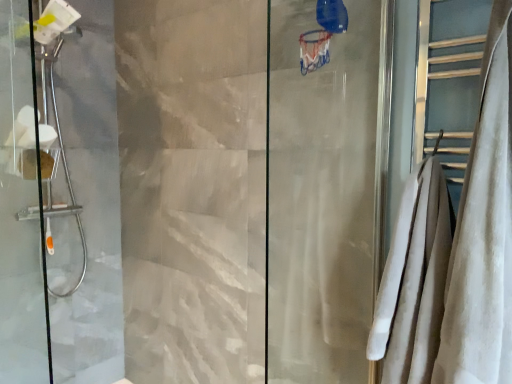
Question: Can you confirm if transparent glass shower door at left, marked as the 1th screen door in a front-to-back arrangement, is thinner than white velvety towel at right?

Choices:
 (A) no
 (B) yes

Answer: (B)

Question: Considering the relative positions of transparent glass shower door at left, positioned as the 2th screen door in back-to-front order, and white velvety towel at right in the image provided, is transparent glass shower door at left, positioned as the 2th screen door in back-to-front order, in front of white velvety towel at right?

Choices:
 (A) yes
 (B) no

Answer: (B)

Question: From the image's perspective, is transparent glass shower door at left, positioned as the 2th screen door in back-to-front order, located beneath white velvety towel at right?

Choices:
 (A) no
 (B) yes

Answer: (B)

Question: Are transparent glass shower door at left, positioned as the 2th screen door in back-to-front order, and white velvety towel at right far apart?

Choices:
 (A) no
 (B) yes

Answer: (B)

Question: Considering the relative positions of transparent glass shower door at left, marked as the 1th screen door in a front-to-back arrangement, and white velvety towel at right in the image provided, is transparent glass shower door at left, marked as the 1th screen door in a front-to-back arrangement, behind white velvety towel at right?

Choices:
 (A) no
 (B) yes

Answer: (B)

Question: From the image's perspective, is brushed metal showerhead at left, the second screen door positioned from the front, above or below white velvety towel at right?

Choices:
 (A) below
 (B) above

Answer: (B)

Question: Considering their positions, is brushed metal showerhead at left, the second screen door positioned from the front, located in front of or behind white velvety towel at right?

Choices:
 (A) behind
 (B) front

Answer: (A)

Question: Is brushed metal showerhead at left, the 1th screen door when ordered from back to front, wider or thinner than white velvety towel at right?

Choices:
 (A) thin
 (B) wide

Answer: (B)

Question: Is brushed metal showerhead at left, the second screen door positioned from the front, taller or shorter than white velvety towel at right?

Choices:
 (A) short
 (B) tall

Answer: (B)

Question: From the image's perspective, relative to white soft towel at right, is brushed metal showerhead at left, the second screen door positioned from the front, above or below?

Choices:
 (A) above
 (B) below

Answer: (A)

Question: Looking at the image, does brushed metal showerhead at left, the second screen door positioned from the front, seem bigger or smaller compared to white soft towel at right?

Choices:
 (A) small
 (B) big

Answer: (B)

Question: From a real-world perspective, is brushed metal showerhead at left, the 1th screen door when ordered from back to front, positioned above or below white soft towel at right?

Choices:
 (A) above
 (B) below

Answer: (A)

Question: Is brushed metal showerhead at left, the 1th screen door when ordered from back to front, spatially inside white soft towel at right, or outside of it?

Choices:
 (A) inside
 (B) outside

Answer: (B)

Question: From a real-world perspective, is white soft towel at right above or below transparent glass shower door at left, marked as the 1th screen door in a front-to-back arrangement?

Choices:
 (A) below
 (B) above

Answer: (A)

Question: From the image's perspective, is white soft towel at right positioned above or below transparent glass shower door at left, marked as the 1th screen door in a front-to-back arrangement?

Choices:
 (A) below
 (B) above

Answer: (A)